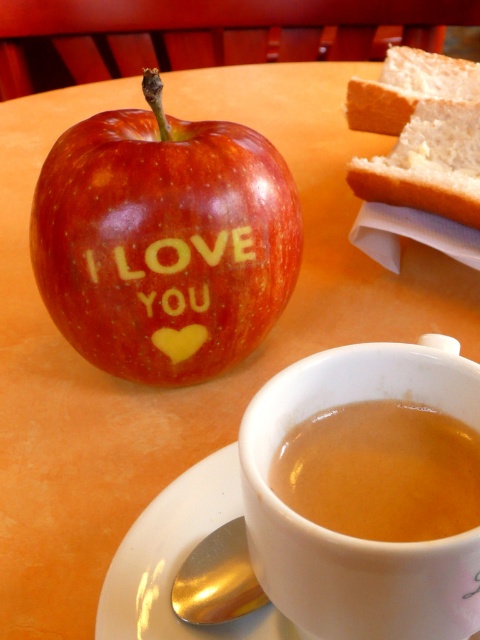
Question: Which of the following is the closest to the observer?

Choices:
 (A) brown liquid at upper center
 (B) white ceramic saucer at lower center
 (C) gold reflective spoon at lower left
 (D) white soft bread at upper right

Answer: (A)

Question: Is the position of white ceramic saucer at lower center less distant than that of white soft bread at upper right?

Choices:
 (A) yes
 (B) no

Answer: (A)

Question: Which of these objects is positioned closest to the white ceramic saucer at lower center?

Choices:
 (A) gold reflective spoon at lower left
 (B) brown matte coffee cup at lower center

Answer: (A)

Question: Among these points, which one is nearest to the camera?

Choices:
 (A) (199, 570)
 (B) (435, 116)
 (C) (202, 349)

Answer: (A)

Question: Is white ceramic saucer at lower center above gold reflective spoon at lower left?

Choices:
 (A) no
 (B) yes

Answer: (B)

Question: Observing the image, what is the correct spatial positioning of shiny red apple at center in reference to brown liquid at upper center?

Choices:
 (A) above
 (B) below

Answer: (A)